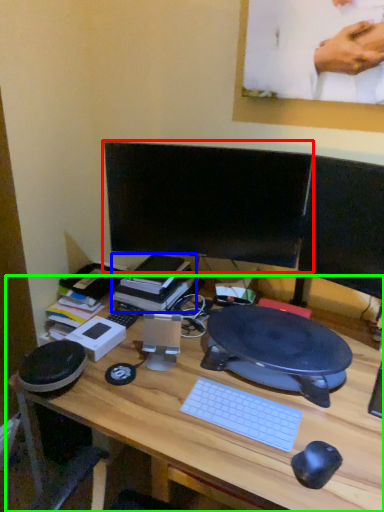
Question: Considering the real-world distances, which object is farthest from computer monitor (highlighted by a red box)? book (highlighted by a blue box) or desk (highlighted by a green box)?

Choices:
 (A) book
 (B) desk

Answer: (B)